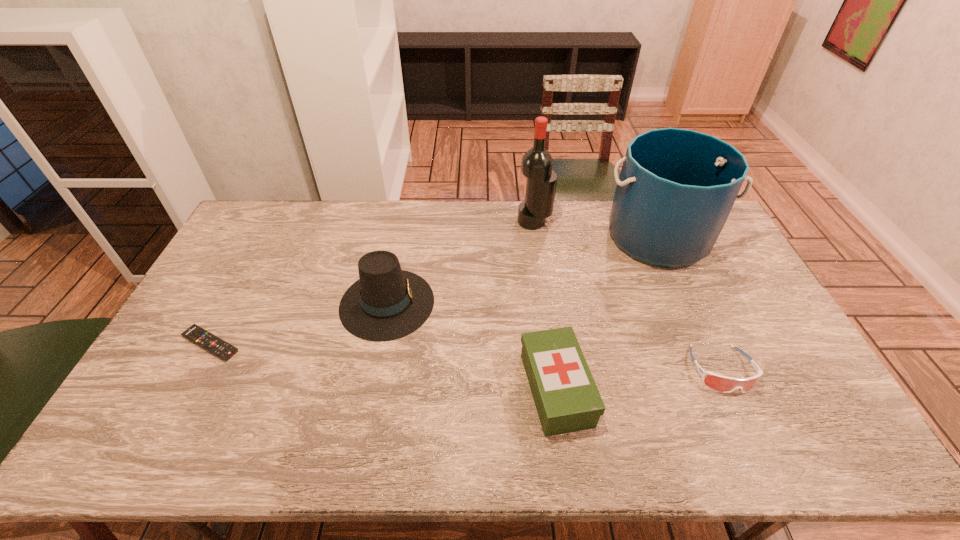
Locate an element on the screen. Image resolution: width=960 pixels, height=540 pixels. object situated at the far right corner is located at coordinates (676, 188).

This screenshot has height=540, width=960. Find the location of `free space at the far edge of the desktop`. free space at the far edge of the desktop is located at coordinates (456, 202).

At what (x,y) coordinates should I click in order to perform the action: click on vacant space at the near edge of the desktop. Please return your answer as a coordinate pair (x, y). The height and width of the screenshot is (540, 960). Looking at the image, I should click on (609, 438).

In order to click on vacant space at the left edge of the desktop in this screenshot , I will do [235, 328].

The width and height of the screenshot is (960, 540). In the image, there is a desktop. Find the location of `vacant space at the right edge`. vacant space at the right edge is located at coordinates (734, 326).

Where is `vacant space at the far left corner`? This screenshot has height=540, width=960. vacant space at the far left corner is located at coordinates point(279,235).

Identify the location of vacant area at the near right corner. This screenshot has width=960, height=540. (836, 434).

Where is `vacant space in between the bucket and the wine bottle`? The height and width of the screenshot is (540, 960). vacant space in between the bucket and the wine bottle is located at coordinates (596, 230).

I want to click on free space that is in between the fourth shortest object and the first-aid kit, so click(x=471, y=346).

Identify the location of vacant point located between the goggles and the leftmost object. (466, 356).